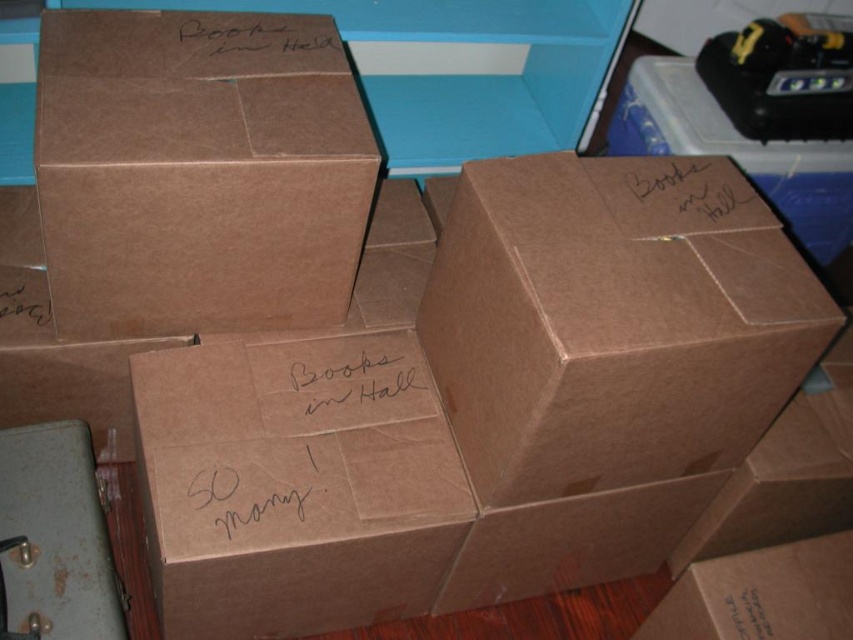
You are a delivery person trying to place a new label between the handwritten brown paper at upper right and the black paper at upper center. The label is 10 inches long. Can you fit it between them without overlapping?

The distance between the handwritten brown paper at upper right and the black paper at upper center is 22.79 inches. Since the label is only 10 inches long, there is enough space to place it between them without overlapping.

You are organizing a storage area and need to place a new item on top of the existing items. Which object, the matte brown cardboard box at center or the black paper at lower left, should you place the new item on to ensure it is supported properly?

The matte brown cardboard box at center is positioned under black paper at lower left, so placing the new item on the black paper at lower left may not provide proper support since it is above the sturdy box. The matte brown cardboard box at center would be a better choice for support.

Consider the image. You are organizing a storage area and need to place a new box on the shelf. You see the black paper at upper center and the matte brown cardboard box at center. Which object is closer to you, and can you place the new box behind the closer one without moving it?

The black paper at upper center is closer to you than the matte brown cardboard box at center. Since the new box needs to be placed behind the closer object, you cannot place it behind the black paper at upper center because there is no space behind it as it is already the closest object in that area.